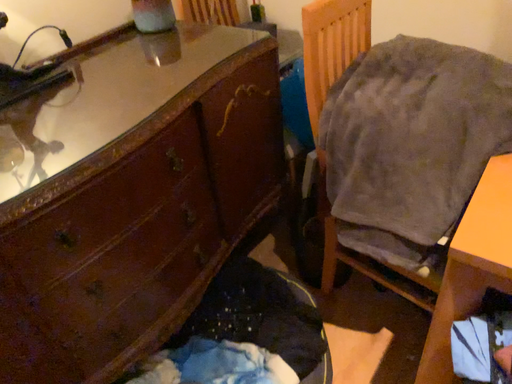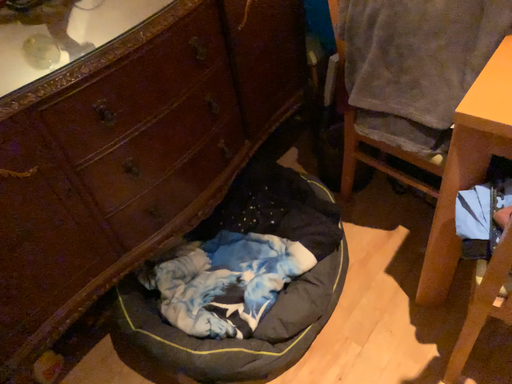
Question: Which way did the camera rotate in the video?

Choices:
 (A) rotated downward
 (B) rotated upward

Answer: (A)